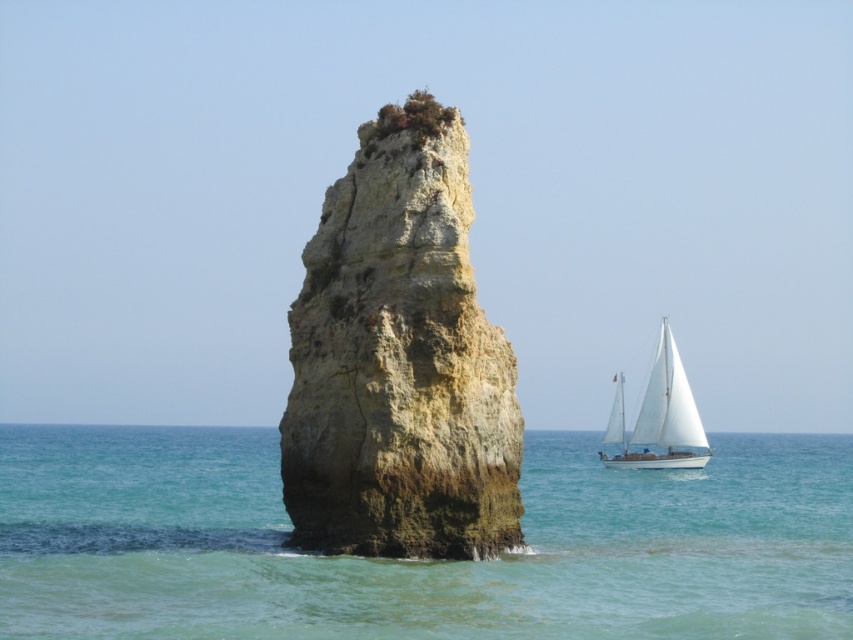
Does clear blue water at center have a greater height compared to rough stone rock at center?

No, clear blue water at center is not taller than rough stone rock at center.

Is clear blue water at center positioned in front of rough stone rock at center?

Yes.

What do you see at coordinates (419, 561) in the screenshot? I see `clear blue water at center` at bounding box center [419, 561].

Locate an element on the screen. The image size is (853, 640). clear blue water at center is located at coordinates (419, 561).

Which of these two, rough stone rock at center or white sailboat at right, stands shorter?

With less height is white sailboat at right.

Between point (344, 276) and point (625, 442), which one is positioned in front?

Point (344, 276) is in front.

This screenshot has width=853, height=640. Identify the location of rough stone rock at center. (399, 360).

Can you confirm if clear blue water at center is positioned above white sailboat at right?

No.

Which is in front, point (805, 620) or point (647, 436)?

Positioned in front is point (805, 620).

In order to click on clear blue water at center in this screenshot , I will do `click(419, 561)`.